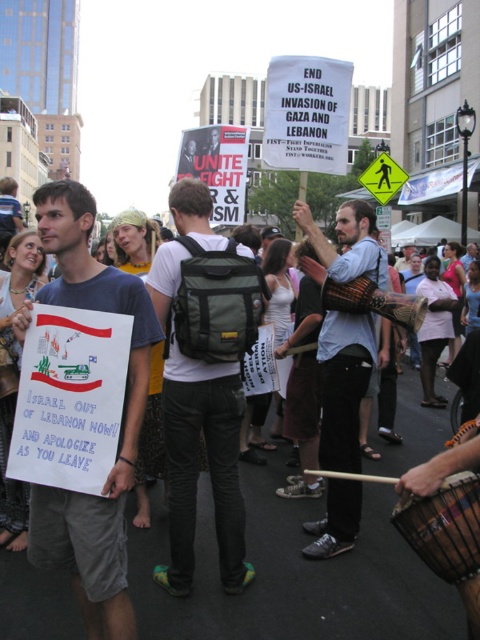
You are a photographer trying to capture the protest scene. You notice the green fabric backpack at center and the dark brown wooden drum at lower right. Which object is positioned lower in the image?

The green fabric backpack at center is located below the dark brown wooden drum at lower right, so the green fabric backpack at center is positioned lower in the image.

You are standing at the protest scene and want to know how far the point at coordinates (230, 376) is from you. Can you determine the distance?

The distance of point (230, 376) from the viewer is 4.43 meters.